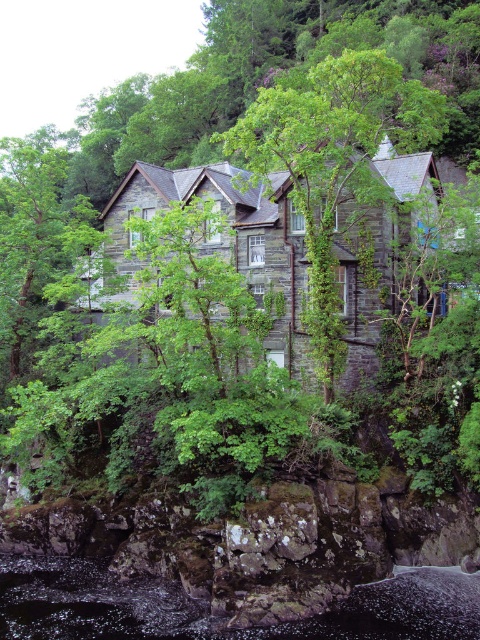
Is green leafy tree at center taller than green leafy tree at left?

Incorrect, green leafy tree at center's height is not larger of green leafy tree at left's.

Is green leafy tree at center to the left of green leafy tree at left from the viewer's perspective?

In fact, green leafy tree at center is to the right of green leafy tree at left.

Where is `green leafy tree at center`? green leafy tree at center is located at coordinates (335, 163).

Where is `green leafy tree at center`? The width and height of the screenshot is (480, 640). green leafy tree at center is located at coordinates (335, 163).

Is point (317, 316) more distant than point (32, 625)?

Yes, it is behind point (32, 625).

Is green leafy tree at center wider than black liquid at lower center?

A: No.

Between point (331, 378) and point (38, 605), which one is positioned in front?

Point (38, 605)

You are a GUI agent. You are given a task and a screenshot of the screen. Output one action in this format:
    pyautogui.click(x=<x>, y=<y>)
    Task: Click on the green leafy tree at center
    This screenshot has height=640, width=480.
    Given the screenshot: What is the action you would take?
    pyautogui.click(x=335, y=163)

Is black liquid at lower center behind green leafy tree at left?

No, it is not.

Between point (132, 593) and point (24, 305), which one is positioned behind?

The point (24, 305) is behind.

The width and height of the screenshot is (480, 640). In order to click on black liquid at lower center in this screenshot , I will do `click(214, 616)`.

Find the location of a particular element. black liquid at lower center is located at coordinates (214, 616).